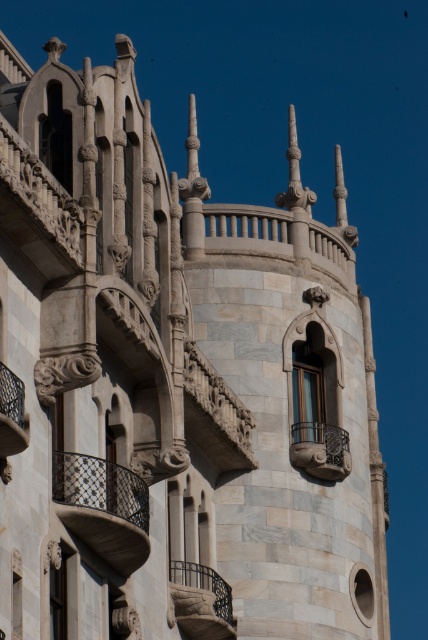
Can you confirm if carved stone balcony at lower center is thinner than polished metal balcony at lower left?

No, carved stone balcony at lower center is not thinner than polished metal balcony at lower left.

Is point (205, 586) positioned in front of point (17, 406)?

No, (205, 586) is further to viewer.

In order to click on carved stone balcony at lower center in this screenshot , I will do `click(201, 602)`.

Can you confirm if dark gray wrought iron balcony at center left is wider than marble stone balcony at center?

Yes.

Is dark gray wrought iron balcony at center left to the left of marble stone balcony at center from the viewer's perspective?

Correct, you'll find dark gray wrought iron balcony at center left to the left of marble stone balcony at center.

Where is `dark gray wrought iron balcony at center left`? The height and width of the screenshot is (640, 428). dark gray wrought iron balcony at center left is located at coordinates (103, 508).

Can you confirm if dark gray wrought iron balcony at center left is positioned to the left of carved stone balcony at lower center?

Indeed, dark gray wrought iron balcony at center left is positioned on the left side of carved stone balcony at lower center.

The width and height of the screenshot is (428, 640). I want to click on dark gray wrought iron balcony at center left, so click(103, 508).